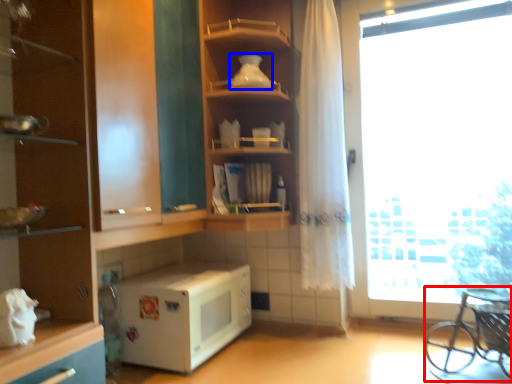
Question: Which object is closer to the camera taking this photo, baby carriage (highlighted by a red box) or appliance (highlighted by a blue box)?

Choices:
 (A) baby carriage
 (B) appliance

Answer: (A)